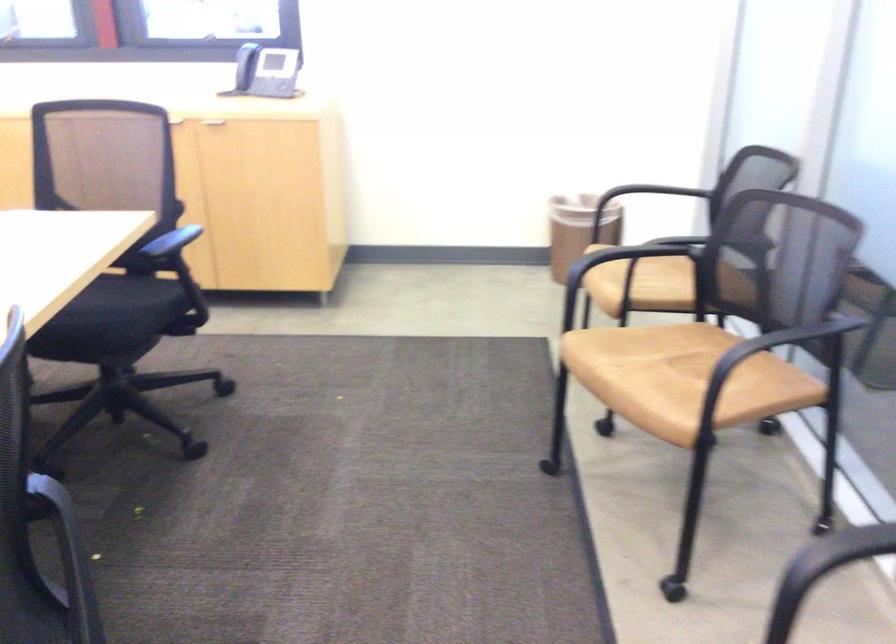
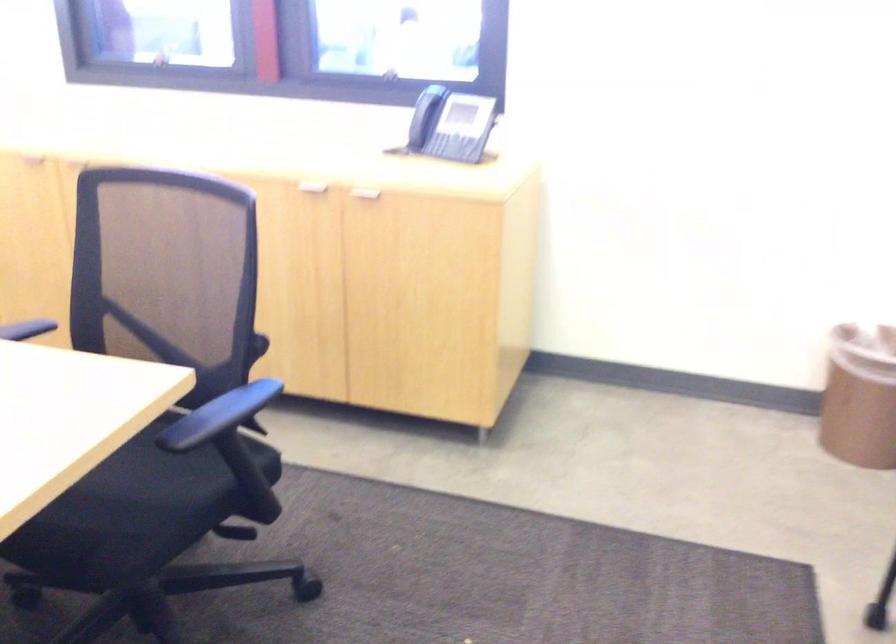
Question: Which direction would the cameraman need to move to produce the second image? Reply with the corresponding letter.

Choices:
 (A) Left
 (B) Right
 (C) Forward
 (D) Backward

Answer: (C)